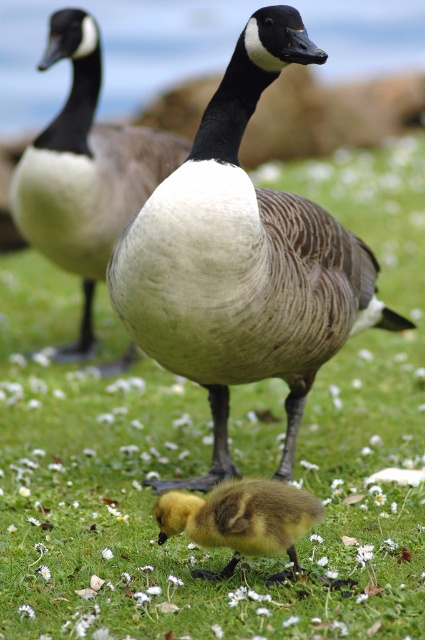
Between brown feathered goose at center and white downy goose at center, which one is positioned lower?

brown feathered goose at center

Can you confirm if brown feathered goose at center is positioned to the left of white downy goose at center?

No, brown feathered goose at center is not to the left of white downy goose at center.

Is point (184, 285) behind point (125, 205)?

No, (184, 285) is in front of (125, 205).

I want to click on brown feathered goose at center, so click(x=243, y=260).

Who is lower down, white downy goose at center or soft yellow duckling at center?

soft yellow duckling at center is below.

Where is `white downy goose at center`? white downy goose at center is located at coordinates (85, 172).

Can you confirm if brown feathered goose at center is thinner than soft yellow duckling at center?

No.

Who is positioned more to the right, brown feathered goose at center or soft yellow duckling at center?

brown feathered goose at center

Describe the element at coordinates (243, 260) in the screenshot. I see `brown feathered goose at center` at that location.

This screenshot has width=425, height=640. What are the coordinates of `brown feathered goose at center` in the screenshot? It's located at (243, 260).